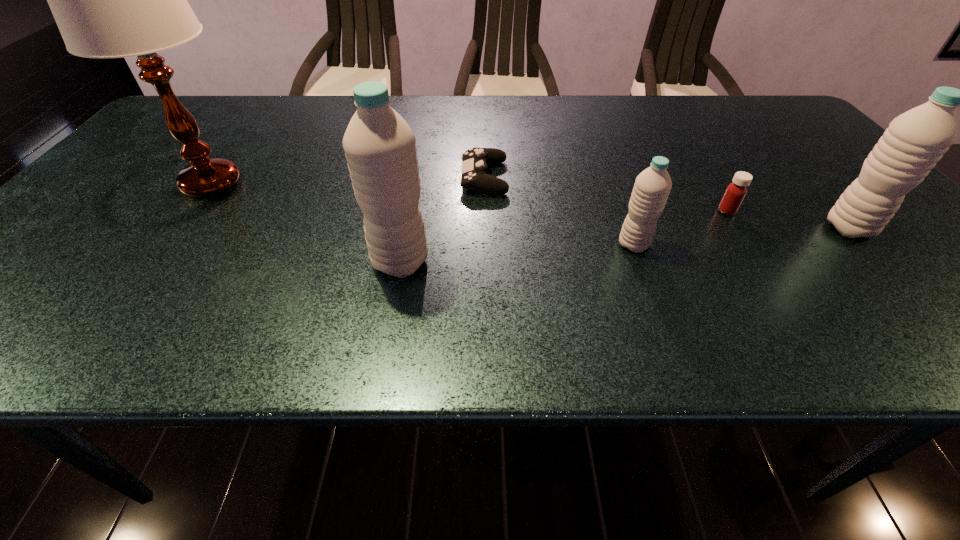
The width and height of the screenshot is (960, 540). In order to click on object that is at the left edge in this screenshot , I will do `click(110, 0)`.

Where is `object that is at the right edge`? object that is at the right edge is located at coordinates (916, 140).

Image resolution: width=960 pixels, height=540 pixels. What are the coordinates of `vacant space at the far edge of the desktop` in the screenshot? It's located at (328, 124).

Where is `vacant space at the near edge of the desktop`? vacant space at the near edge of the desktop is located at coordinates (x=270, y=302).

In the image, there is a desktop. At what (x,y) coordinates should I click in order to perform the action: click on vacant space at the left edge. Please return your answer as a coordinate pair (x, y). Looking at the image, I should click on (160, 163).

Where is `free space at the right edge of the desktop`? free space at the right edge of the desktop is located at coordinates (913, 232).

Locate an element on the screen. The image size is (960, 540). free space at the near right corner is located at coordinates (869, 270).

Locate an element on the screen. vacant space in between the fourth object from right to left and the medicine is located at coordinates (606, 194).

The width and height of the screenshot is (960, 540). I want to click on empty space between the third shortest object and the leftmost water bottle, so click(517, 254).

Identify the location of free space between the rightmost water bottle and the second shortest object. (788, 220).